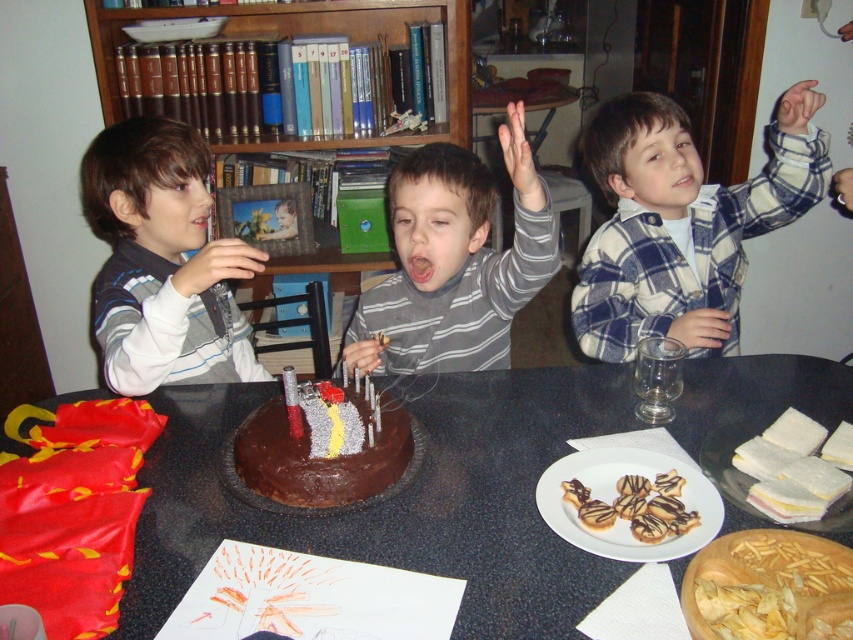
Question: Where is gray striped shirt at center located in relation to chocolatesmoothcake at center in the image?

Choices:
 (A) right
 (B) left

Answer: (A)

Question: Based on their relative distances, which object is farther from the chocolate cake at center?

Choices:
 (A) gray striped shirt at center
 (B) wooden bookshelf at upper center
 (C) chocolatesmoothcake at center

Answer: (B)

Question: Among these objects, which one is farthest from the camera?

Choices:
 (A) blue plaid shirt at upper right
 (B) wooden bookshelf at upper center
 (C) matte gray sweater at left
 (D) gray striped shirt at center

Answer: (B)

Question: Which object appears closest to the camera in this image?

Choices:
 (A) matte gray sweater at left
 (B) chocolate cake at center

Answer: (B)

Question: In this image, where is matte gray sweater at left located relative to chocolatesmoothcake at center?

Choices:
 (A) right
 (B) left

Answer: (B)

Question: Where is matte gray sweater at left located in relation to chocolatesmoothcake at center in the image?

Choices:
 (A) below
 (B) above

Answer: (B)